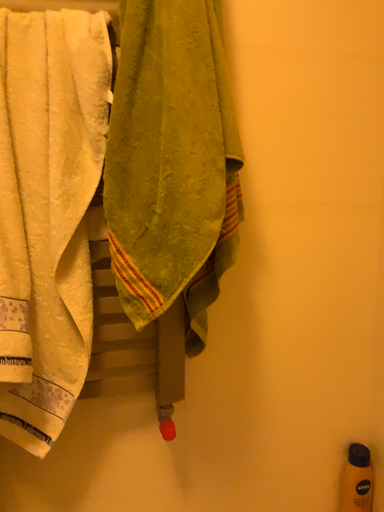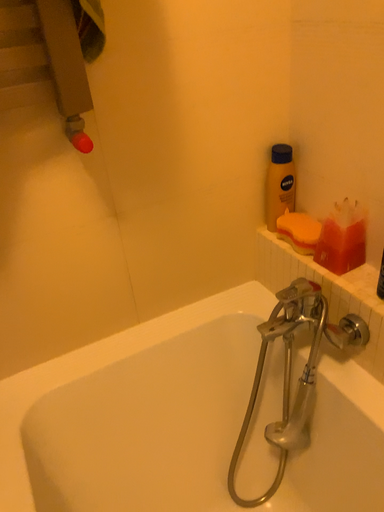
Question: How did the camera likely rotate when shooting the video?

Choices:
 (A) rotated right
 (B) rotated left

Answer: (A)